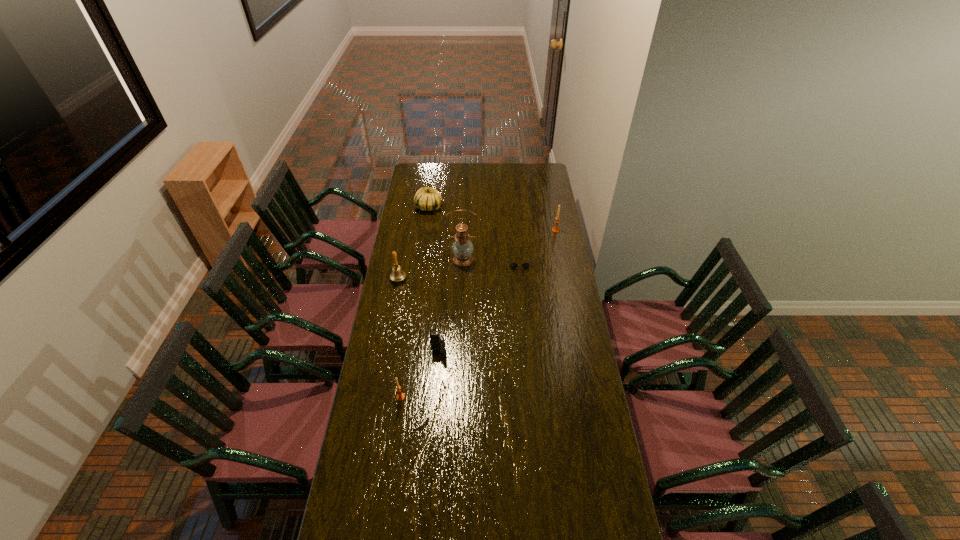
You are a GUI agent. You are given a task and a screenshot of the screen. Output one action in this format:
    pyautogui.click(x=<x>, y=<y>)
    Task: Click on the vacant region between the farthest object and the cellular telephone
    The width and height of the screenshot is (960, 540).
    Given the screenshot: What is the action you would take?
    pyautogui.click(x=434, y=280)

In order to click on free area in between the tallest object and the cellular telephone in this screenshot , I will do `click(451, 306)`.

The width and height of the screenshot is (960, 540). Identify the location of empty location between the left candle_holder and the taller candle_holder. (478, 314).

Locate an element on the screen. unoccupied area between the nearer candle_holder and the oil lamp is located at coordinates (432, 328).

You are a GUI agent. You are given a task and a screenshot of the screen. Output one action in this format:
    pyautogui.click(x=<x>, y=<y>)
    Task: Click on the free area in between the shorter candle_holder and the cellular telephone
    The height and width of the screenshot is (540, 960).
    Given the screenshot: What is the action you would take?
    pyautogui.click(x=420, y=375)

Locate an element on the screen. object that is the closest to the nearest object is located at coordinates (437, 341).

The image size is (960, 540). Identify the location of object that stands as the fourth closest to the taller candle_holder. (398, 274).

You are a GUI agent. You are given a task and a screenshot of the screen. Output one action in this format:
    pyautogui.click(x=<x>, y=<y>)
    Task: Click on the vacant region that satisfies the following two spatial constraints: 1. on the front side of the oil lamp; 2. on the left side of the gourd
    
    Given the screenshot: What is the action you would take?
    421,260

In order to click on vacant space that satisfies the following two spatial constraints: 1. on the back side of the oil lamp; 2. on the right side of the nearest object in this screenshot , I will do `click(420, 260)`.